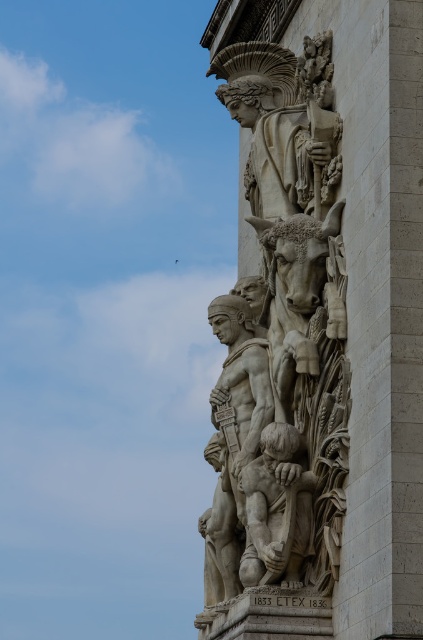
Which is in front, point (277, 221) or point (271, 422)?

Point (271, 422) is more forward.

Does point (225, 513) come closer to viewer compared to point (260, 461)?

No, (225, 513) is behind (260, 461).

The image size is (423, 640). What are the coordinates of `white stone sculpture at center` in the screenshot? It's located at (280, 358).